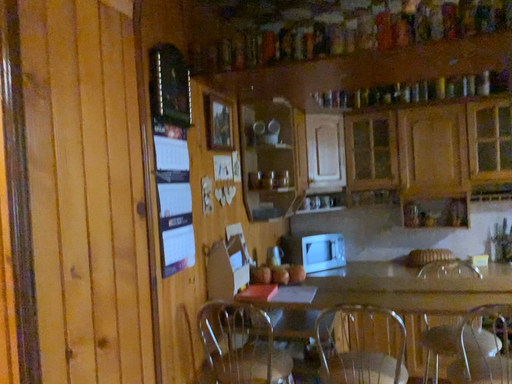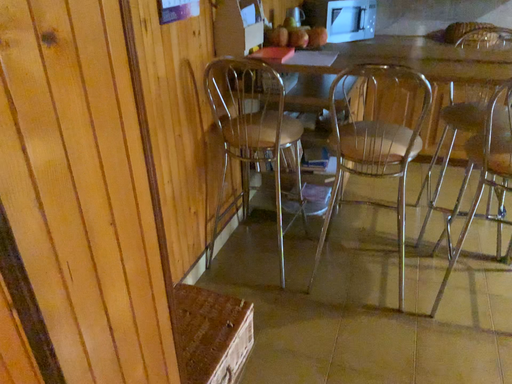
Question: How did the camera likely rotate when shooting the video?

Choices:
 (A) rotated upward
 (B) rotated downward

Answer: (B)